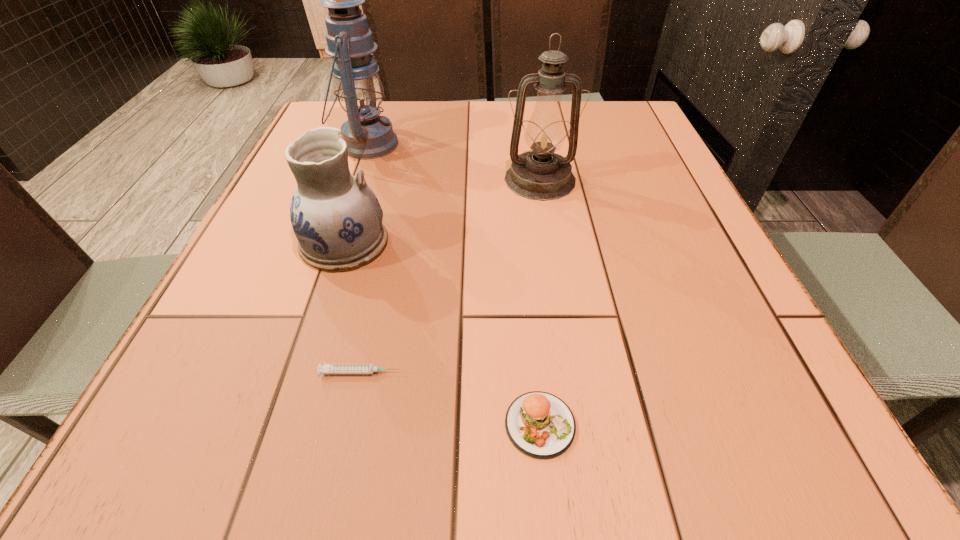
What are the coordinates of `blank space that satisfies the following two spatial constraints: 1. on the front side of the nearest object; 2. on the right side of the third shortest object` in the screenshot? It's located at (286, 424).